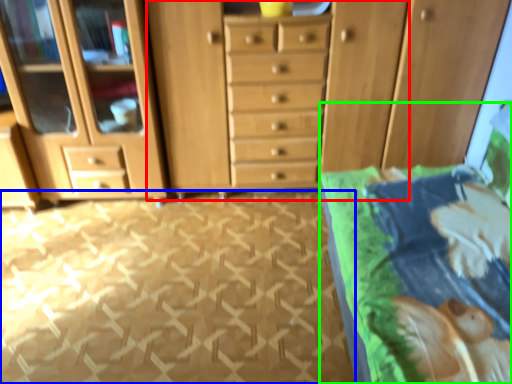
Question: Which object is the farthest from dresser (highlighted by a red box)? Choose among these: tile (highlighted by a blue box) or bed (highlighted by a green box).

Choices:
 (A) tile
 (B) bed

Answer: (B)